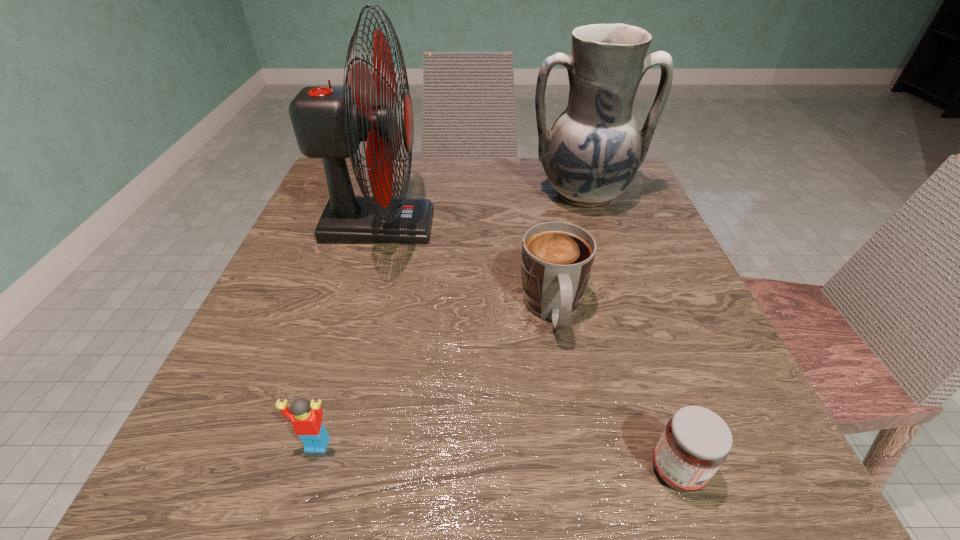
You are a GUI agent. You are given a task and a screenshot of the screen. Output one action in this format:
    pyautogui.click(x=<x>, y=<y>)
    Task: Click on the free space between the Lego and the pitcher
    This screenshot has width=960, height=540.
    Given the screenshot: What is the action you would take?
    pyautogui.click(x=450, y=320)

Where is `empty location between the fourth shortest object and the jam`? empty location between the fourth shortest object and the jam is located at coordinates (631, 332).

Where is `unoccupied area between the tallest object and the pitcher`? The width and height of the screenshot is (960, 540). unoccupied area between the tallest object and the pitcher is located at coordinates (481, 210).

I want to click on free point between the pitcher and the Lego, so click(x=450, y=320).

Image resolution: width=960 pixels, height=540 pixels. What are the coordinates of `empty space between the Lego and the pitcher` in the screenshot? It's located at (450, 320).

Locate which object ranks third in proximity to the jam. Please provide its 2D coordinates. Your answer should be formatted as a tuple, i.e. [(x, y)], where the tuple contains the x and y coordinates of a point satisfying the conditions above.

[(329, 122)]

Where is `object that stands as the third closest to the jam`? This screenshot has height=540, width=960. object that stands as the third closest to the jam is located at coordinates (329, 122).

Locate an element on the screen. This screenshot has height=540, width=960. free region that satisfies the following two spatial constraints: 1. on the front-facing side of the jam; 2. on the left side of the second tallest object is located at coordinates [674, 470].

Where is `blank area in the image that satisfies the following two spatial constraints: 1. on the face of the Lego; 2. on the left side of the jam`? blank area in the image that satisfies the following two spatial constraints: 1. on the face of the Lego; 2. on the left side of the jam is located at coordinates (310, 470).

Find the location of `vacant region that satisfies the following two spatial constraints: 1. on the front-facing side of the tallest object; 2. on the back side of the jam`. vacant region that satisfies the following two spatial constraints: 1. on the front-facing side of the tallest object; 2. on the back side of the jam is located at coordinates (307, 470).